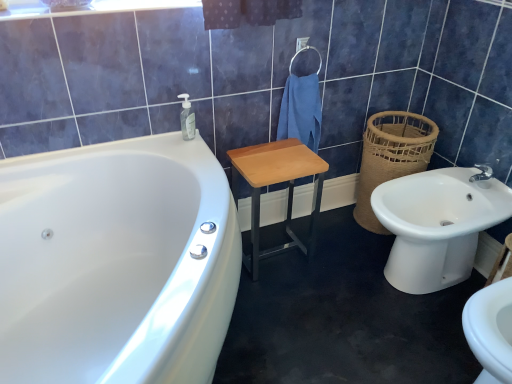
Locate an element on the screen. vacant area that is situated to the right of wooden/matte step stool at center is located at coordinates (332, 253).